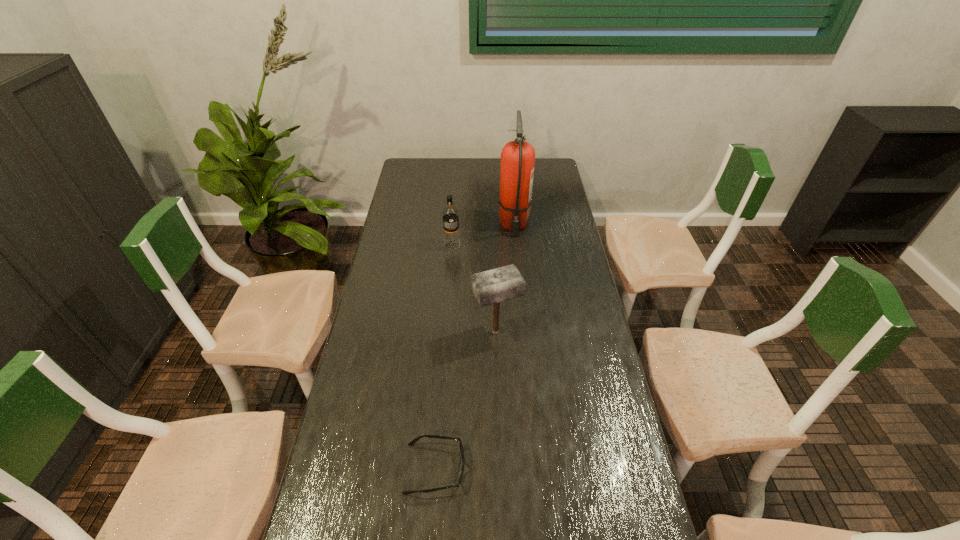
I want to click on the tallest object, so click(517, 157).

Locate an element on the screen. This screenshot has height=540, width=960. the third farthest object is located at coordinates (490, 287).

The width and height of the screenshot is (960, 540). I want to click on mallet, so click(490, 287).

The height and width of the screenshot is (540, 960). I want to click on vodka, so click(451, 240).

Find the location of `the shortest object`. the shortest object is located at coordinates (415, 440).

This screenshot has width=960, height=540. Find the location of `spectacles`. spectacles is located at coordinates (415, 440).

Where is `vacant position located on the nozzle of the fire extinguisher`? The height and width of the screenshot is (540, 960). vacant position located on the nozzle of the fire extinguisher is located at coordinates (519, 285).

Where is `free space located on the back of the mallet`? free space located on the back of the mallet is located at coordinates (493, 268).

You are a GUI agent. You are given a task and a screenshot of the screen. Output one action in this format:
    pyautogui.click(x=<x>, y=<y>)
    Task: Click on the vacant space located 0.350m on the label of the vodka
    
    Given the screenshot: What is the action you would take?
    pyautogui.click(x=446, y=315)

Where is `blank space located 0.220m on the front-facing side of the nearest object`? The width and height of the screenshot is (960, 540). blank space located 0.220m on the front-facing side of the nearest object is located at coordinates (550, 469).